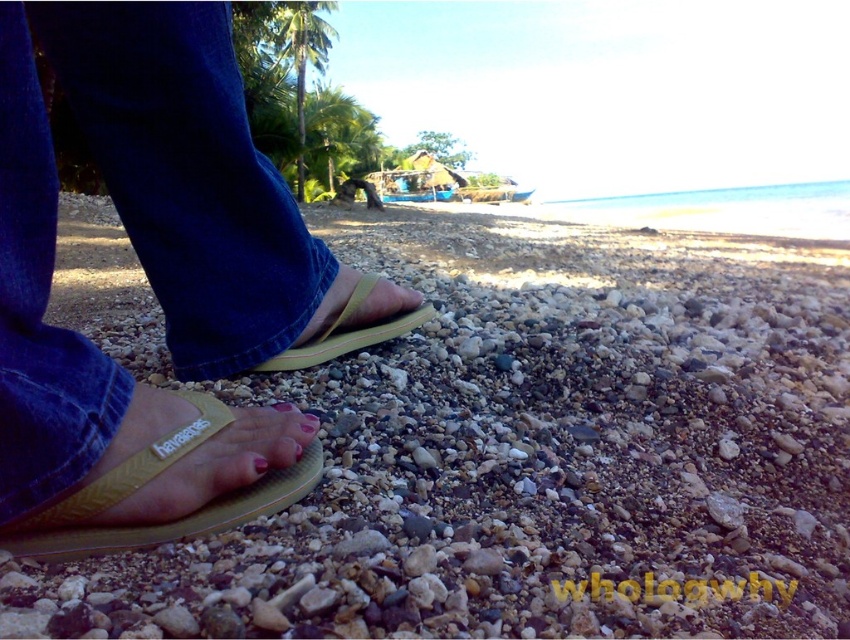
Does yellow rubber sandal at lower left have a lesser width compared to pink matte nail at center?

No.

Does point (248, 506) come behind point (253, 460)?

Yes, point (248, 506) is behind point (253, 460).

Where is `yellow rubber sandal at lower left`? yellow rubber sandal at lower left is located at coordinates (156, 483).

The width and height of the screenshot is (850, 640). In order to click on yellow rubber sandal at lower left in this screenshot , I will do `click(156, 483)`.

Which of these two, yellow rubber flip-flops at center or green leafy palm tree at upper left, stands shorter?

yellow rubber flip-flops at center is shorter.

Who is lower down, yellow rubber flip-flops at center or green leafy palm tree at upper left?

yellow rubber flip-flops at center is below.

In order to click on yellow rubber flip-flops at center in this screenshot , I will do `click(531, 451)`.

Find the location of a particular element. This screenshot has width=850, height=640. yellow rubber flip-flops at center is located at coordinates (531, 451).

Between yellow rubber flip-flops at center and green leafy palm tree at upper center, which one appears on the right side from the viewer's perspective?

From the viewer's perspective, yellow rubber flip-flops at center appears more on the right side.

Is yellow rubber flip-flops at center closer to the viewer compared to green leafy palm tree at upper center?

That is True.

Between point (514, 548) and point (286, 156), which one is positioned in front?

Point (514, 548) is more forward.

I want to click on yellow rubber flip-flops at center, so click(x=531, y=451).